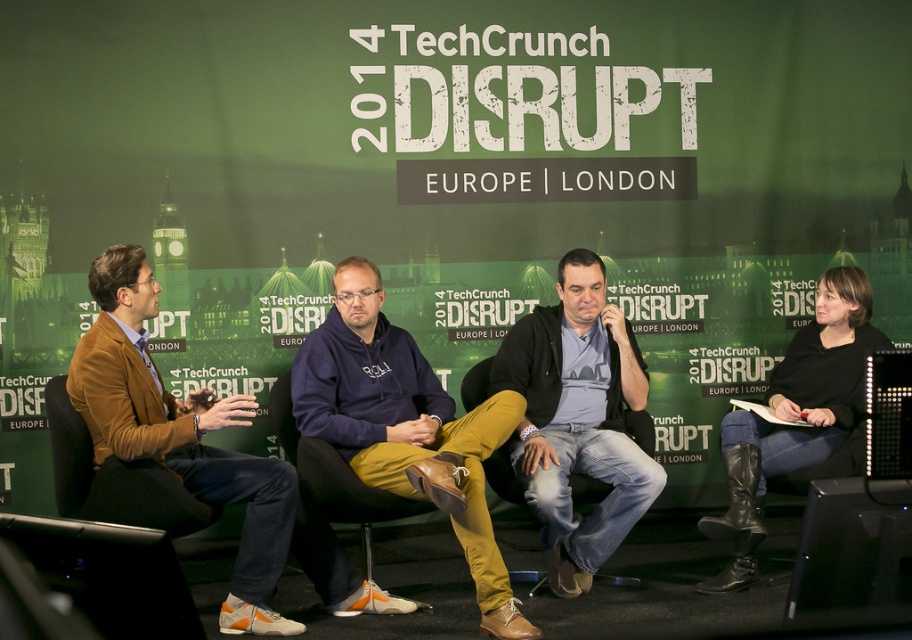
Question: Is dark blue hoodie at center closer to camera compared to black leather boots at lower right?

Choices:
 (A) no
 (B) yes

Answer: (B)

Question: Which of the following is the closest to the observer?

Choices:
 (A) black fabric chair at center
 (B) brown leather jacket at left

Answer: (B)

Question: Does dark blue hoodie at center come in front of denim jeans at center?

Choices:
 (A) no
 (B) yes

Answer: (B)

Question: Considering the real-world distances, which object is closest to the dark blue hoodie at center?

Choices:
 (A) brown leather jacket at left
 (B) denim jeans at center

Answer: (B)

Question: Which of the following is the closest to the observer?

Choices:
 (A) black fabric chair at center
 (B) brown leather jacket at left
 (C) black leather boots at lower right

Answer: (B)

Question: Is denim jeans at center wider than brown leather jacket at left?

Choices:
 (A) no
 (B) yes

Answer: (A)